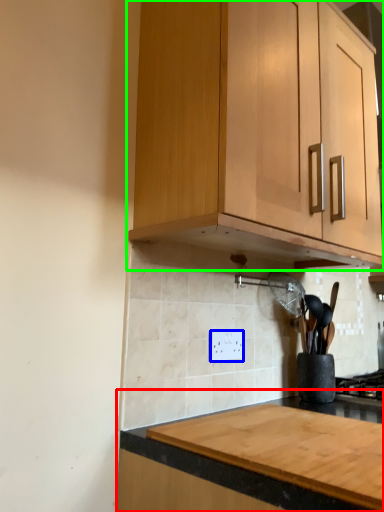
Question: Considering the real-world distances, which object is farthest from countertop (highlighted by a red box)? electric outlet (highlighted by a blue box) or cabinetry (highlighted by a green box)?

Choices:
 (A) electric outlet
 (B) cabinetry

Answer: (B)